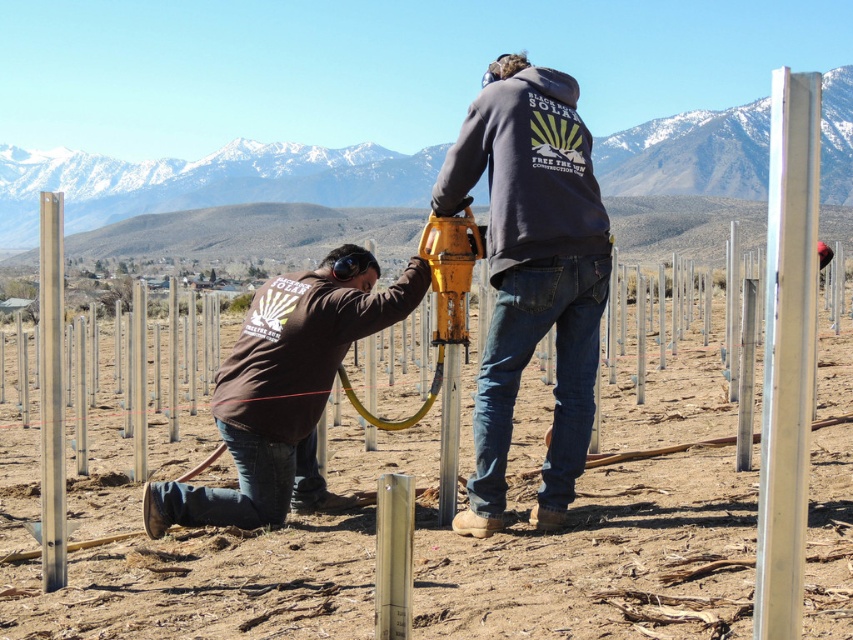
Question: Is polished silver pole at right positioned before polished silver pole at center?

Choices:
 (A) no
 (B) yes

Answer: (B)

Question: Which object is the farthest from the dark blue hoodie at center?

Choices:
 (A) polished silver pole at center
 (B) brown dirt field at center

Answer: (A)

Question: Where is dark blue hoodie at center located in relation to polished silver pole at right in the image?

Choices:
 (A) right
 (B) left

Answer: (B)

Question: Estimate the real-world distances between objects in this image. Which object is closer to the brown matte shirt at lower left?

Choices:
 (A) polished silver pole at center
 (B) dark blue hoodie at center
 (C) polished silver pole at right

Answer: (B)

Question: Which object appears farthest from the camera in this image?

Choices:
 (A) polished silver pole at right
 (B) brown matte shirt at lower left
 (C) dark blue hoodie at center

Answer: (B)

Question: Does dark blue hoodie at center appear over polished silver pole at center?

Choices:
 (A) no
 (B) yes

Answer: (A)